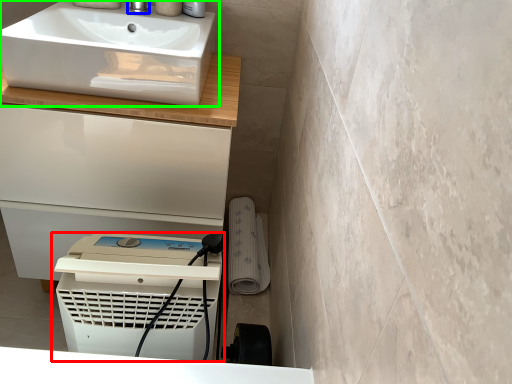
Question: Which object is positioned closest to home appliance (highlighted by a red box)? Select from tap (highlighted by a blue box) and sink (highlighted by a green box).

Choices:
 (A) tap
 (B) sink

Answer: (B)